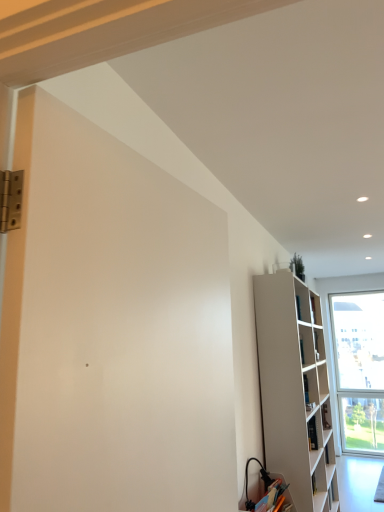
Question: From a real-world perspective, is white matte screen door at left located higher than matte white cabinet at lower right?

Choices:
 (A) yes
 (B) no

Answer: (A)

Question: Is white matte screen door at left to the left of matte white cabinet at lower right from the viewer's perspective?

Choices:
 (A) no
 (B) yes

Answer: (B)

Question: Considering the relative sizes of white matte screen door at left and matte white cabinet at lower right in the image provided, is white matte screen door at left bigger than matte white cabinet at lower right?

Choices:
 (A) no
 (B) yes

Answer: (B)

Question: Does white matte screen door at left have a lesser height compared to matte white cabinet at lower right?

Choices:
 (A) no
 (B) yes

Answer: (A)

Question: Is matte white cabinet at lower right at the back of white matte screen door at left?

Choices:
 (A) no
 (B) yes

Answer: (A)

Question: From the image's perspective, is white matte screen door at left beneath matte white cabinet at lower right?

Choices:
 (A) no
 (B) yes

Answer: (A)

Question: Does white matte bookshelf at right have a greater width compared to matte white cabinet at lower right?

Choices:
 (A) no
 (B) yes

Answer: (B)

Question: Is the position of white matte bookshelf at right less distant than that of matte white cabinet at lower right?

Choices:
 (A) no
 (B) yes

Answer: (A)

Question: Does white matte bookshelf at right come behind matte white cabinet at lower right?

Choices:
 (A) yes
 (B) no

Answer: (A)

Question: From a real-world perspective, is white matte bookshelf at right located higher than matte white cabinet at lower right?

Choices:
 (A) no
 (B) yes

Answer: (B)

Question: Does white matte bookshelf at right have a lesser height compared to matte white cabinet at lower right?

Choices:
 (A) yes
 (B) no

Answer: (B)

Question: Considering the relative sizes of white matte bookshelf at right and matte white cabinet at lower right in the image provided, is white matte bookshelf at right thinner than matte white cabinet at lower right?

Choices:
 (A) yes
 (B) no

Answer: (B)

Question: Does white matte screen door at left contain white matte bookshelf at right?

Choices:
 (A) yes
 (B) no

Answer: (B)